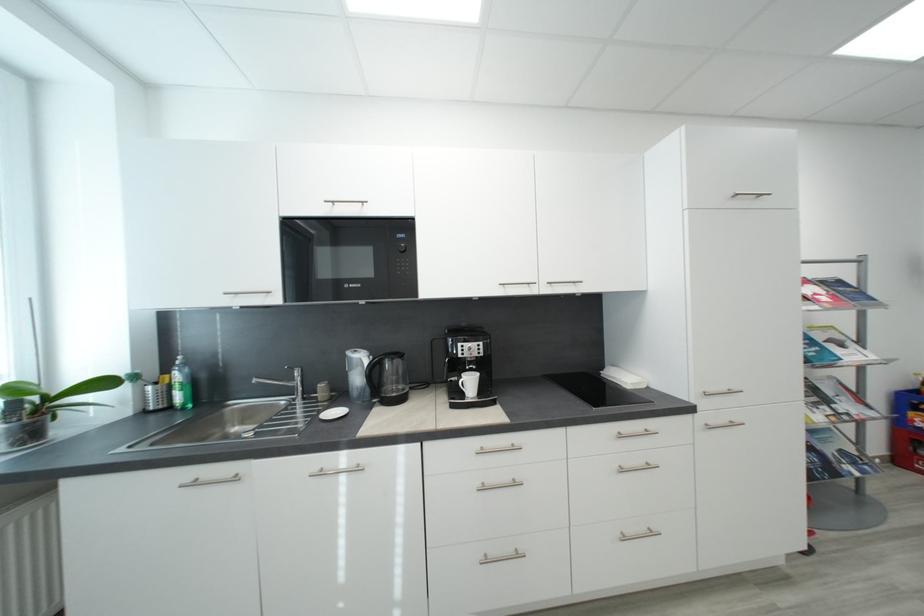
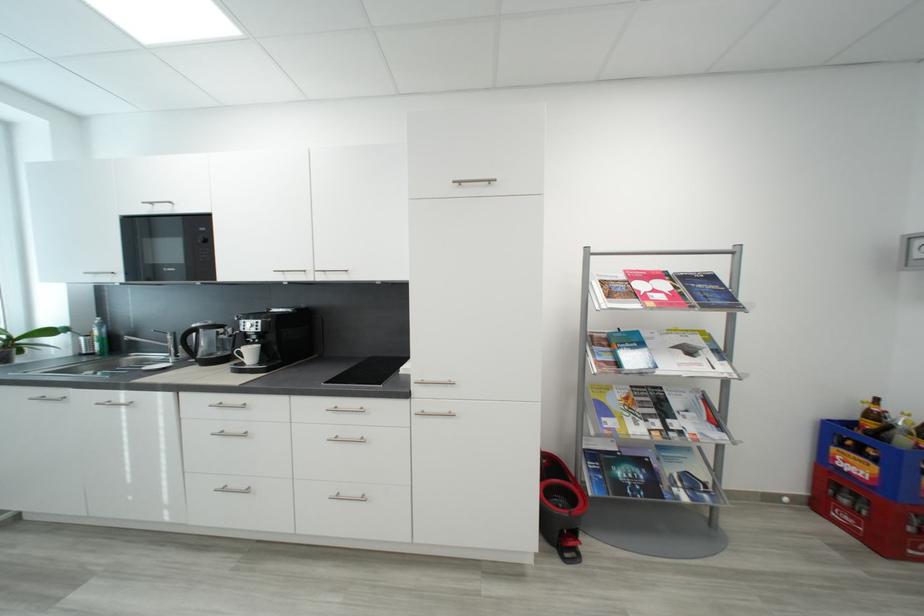
Where in the second image is the point corresponding to the point at 847,284 from the first image?

(718, 280)